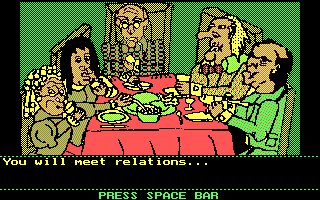
You are a GUI agent. You are given a task and a screenshot of the screen. Output one action in this format:
    pyautogui.click(x=<x>, y=<y>)
    Task: Click on the spoon
    This screenshot has width=320, height=200.
    Given the screenshot: What is the action you would take?
    pyautogui.click(x=138, y=102), pyautogui.click(x=179, y=113)